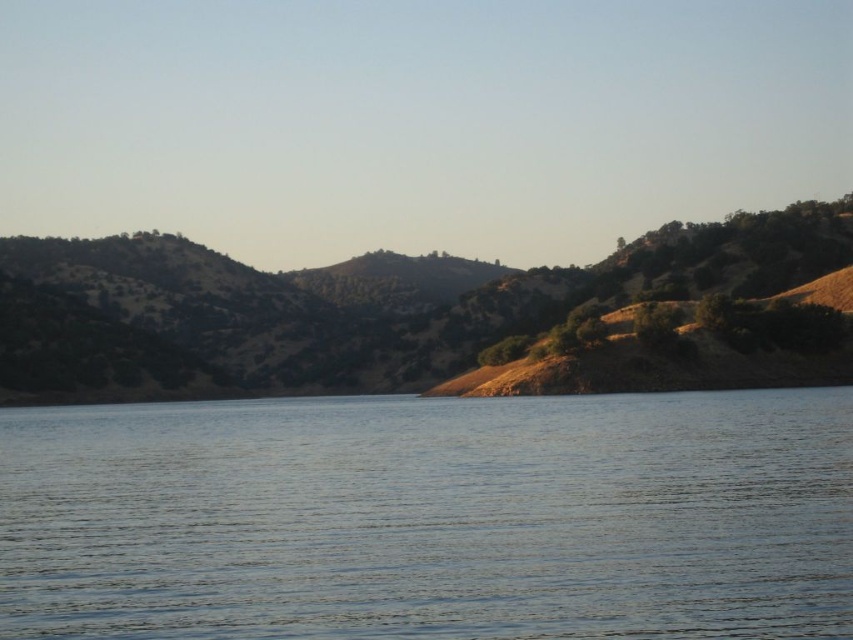
You are standing at the edge of the large body of water in the foreground and want to reach both point (x=340, y=413) and point (x=326, y=280). Which point should you head towards first if you want to reach the closer one first?

Point (x=340, y=413) is closer to the viewer than point (x=326, y=280), so you should head towards point (x=340, y=413) first.